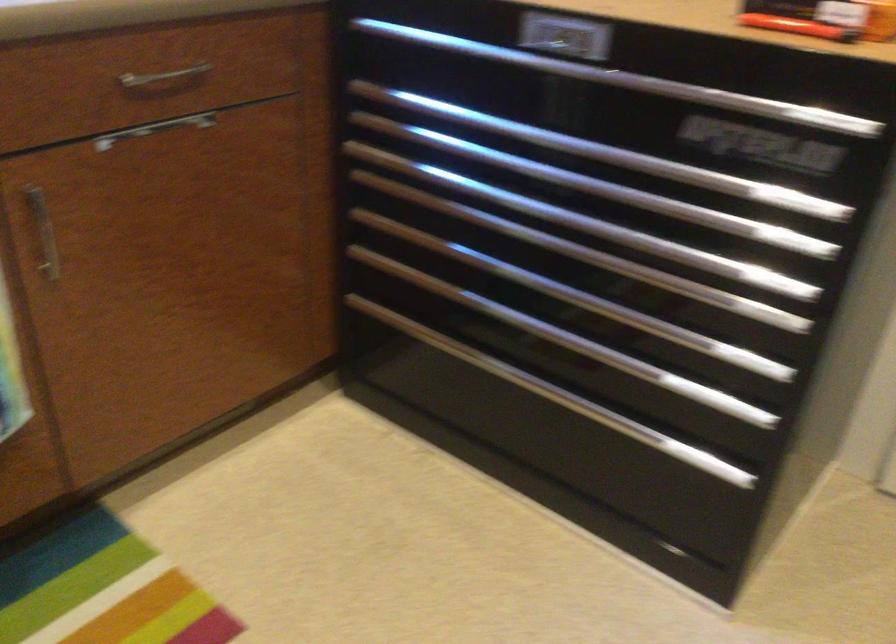
This screenshot has height=644, width=896. In order to click on vertical cabinet handle in this screenshot , I will do `click(164, 78)`.